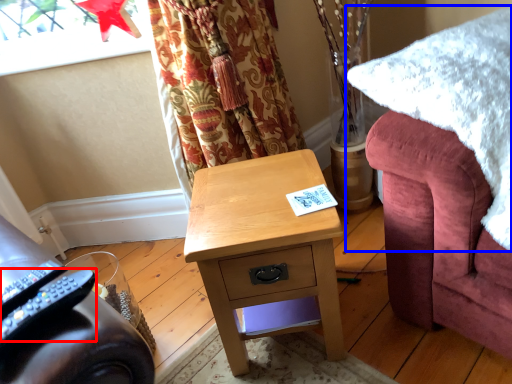
Question: Which object is further to the camera taking this photo, remote control (highlighted by a red box) or blanket (highlighted by a blue box)?

Choices:
 (A) remote control
 (B) blanket

Answer: (B)